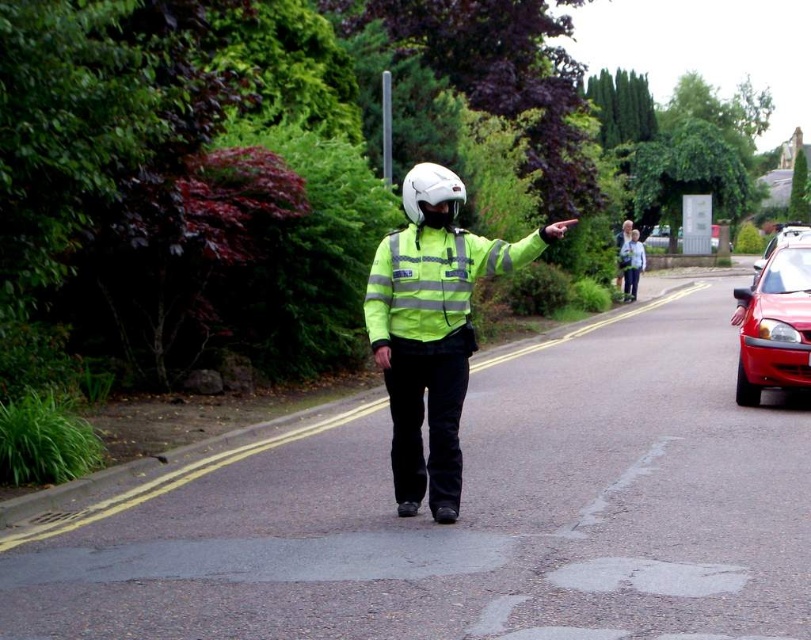
You are a traffic officer standing at the center of the road. You notice a point marked at coordinates (775, 323). What object does this point correspond to in the scene?

The point corresponds to the shiny red car at right.

You are a driver approaching the intersection and see the traffic officer pointing at point (434, 280). What is the officer directing your attention to?

The officer is pointing at the high visibility reflective jacket at center, indicating that you should pay attention to their signals and follow their directions.

You are a traffic officer directing vehicles on a two lane road. You see a shiny red car at right and a metallic red car at right. Which car is closer to you?

The shiny red car at right is smaller than the metallic red car at right, so the metallic red car at right is closer to you.